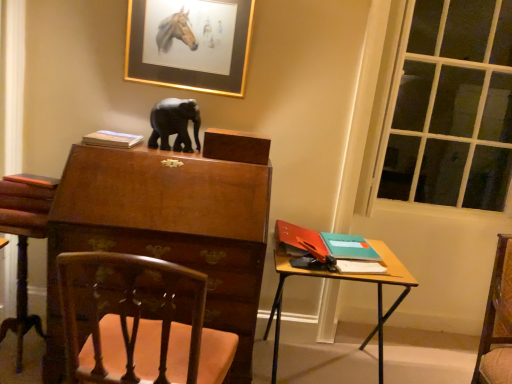
Find the location of a particular element. free spot above black glossy elephant at upper center (from a real-world perspective) is located at coordinates (176, 102).